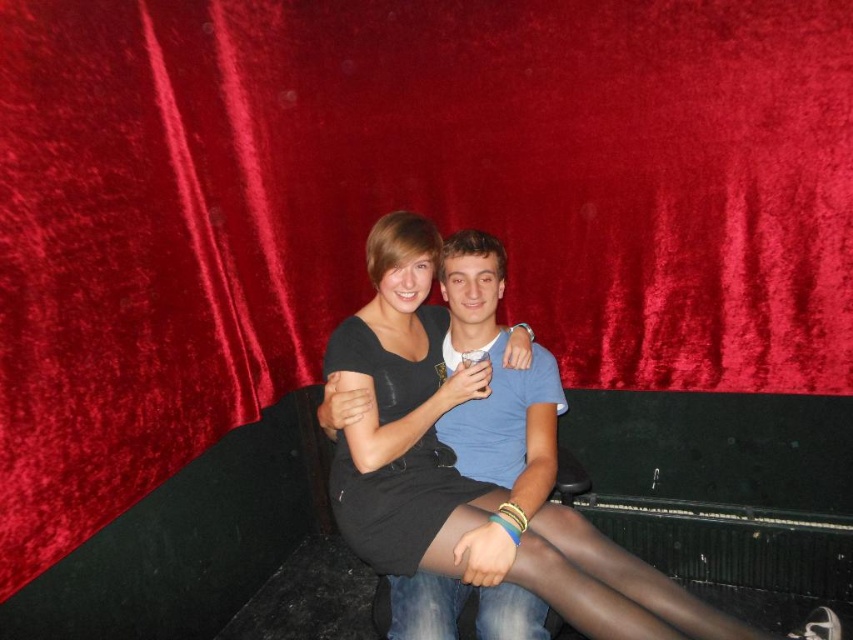
Based on the scene description, which object is positioned to the left of the other between the matte black dress at center and the black matte tights at center?

The matte black dress at center is to the left of the black matte tights at center.

What is located at the point with coordinates (445,429) in the image?

The point at coordinates (445,429) indicates the location of the black matte dress at center.